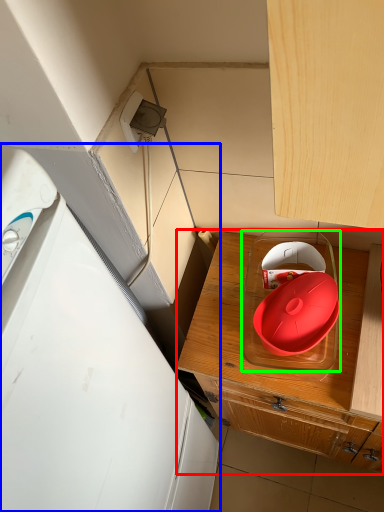
Question: Considering the real-world distances, which object is farthest from cabinetry (highlighted by a red box)? home appliance (highlighted by a blue box) or appliance (highlighted by a green box)?

Choices:
 (A) home appliance
 (B) appliance

Answer: (A)